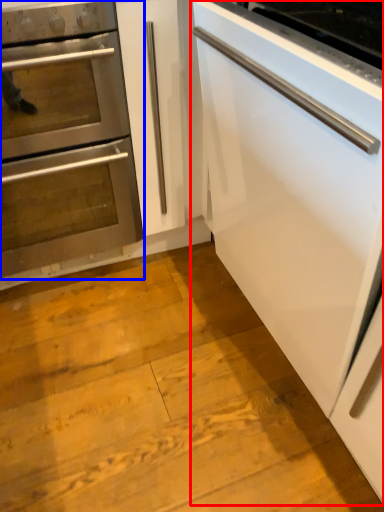
Question: Which of the following is the farthest to the observer, cabinetry (highlighted by a red box) or oven (highlighted by a blue box)?

Choices:
 (A) cabinetry
 (B) oven

Answer: (B)